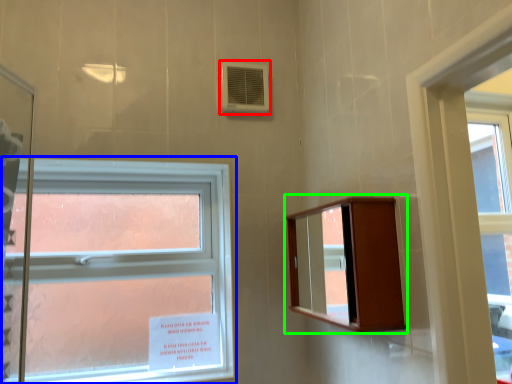
Question: Which object is positioned closest to air conditioning (highlighted by a red box)? Select from window (highlighted by a blue box) and medicine cabinet (highlighted by a green box).

Choices:
 (A) window
 (B) medicine cabinet

Answer: (A)